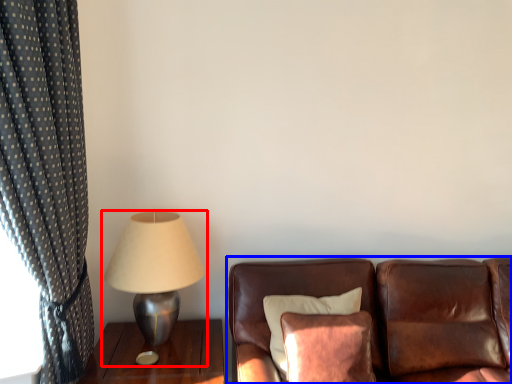
Question: Which object appears farthest to the camera in this image, lamp (highlighted by a red box) or studio couch (highlighted by a blue box)?

Choices:
 (A) lamp
 (B) studio couch

Answer: (A)